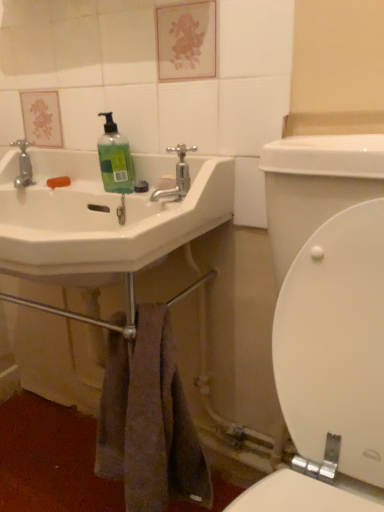
Question: From the image's perspective, is brown textured towel at lower center above or below green matte liquid soap at upper left?

Choices:
 (A) above
 (B) below

Answer: (B)

Question: Is brown textured towel at lower center wider or thinner than green matte liquid soap at upper left?

Choices:
 (A) thin
 (B) wide

Answer: (B)

Question: Estimate the real-world distances between objects in this image. Which object is farther from the white glossy sink at left?

Choices:
 (A) green matte liquid soap at upper left
 (B) brown textured towel at lower center
 (C) polished chrome faucet at upper center
 (D) white glossy toilet at lower right

Answer: (D)

Question: Considering the real-world distances, which object is closest to the white glossy toilet at lower right?

Choices:
 (A) green matte liquid soap at upper left
 (B) white glossy sink at left
 (C) polished chrome faucet at upper center
 (D) brown textured towel at lower center

Answer: (D)